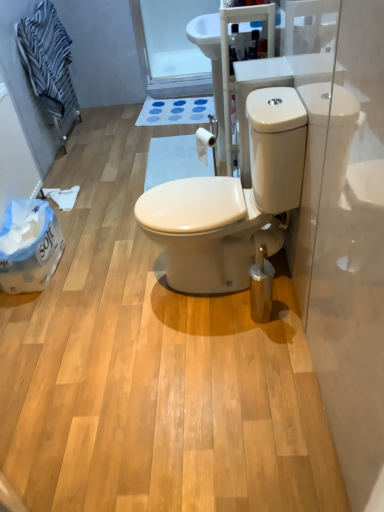
Identify the location of free space in front of white plastic bag at left. (41, 313).